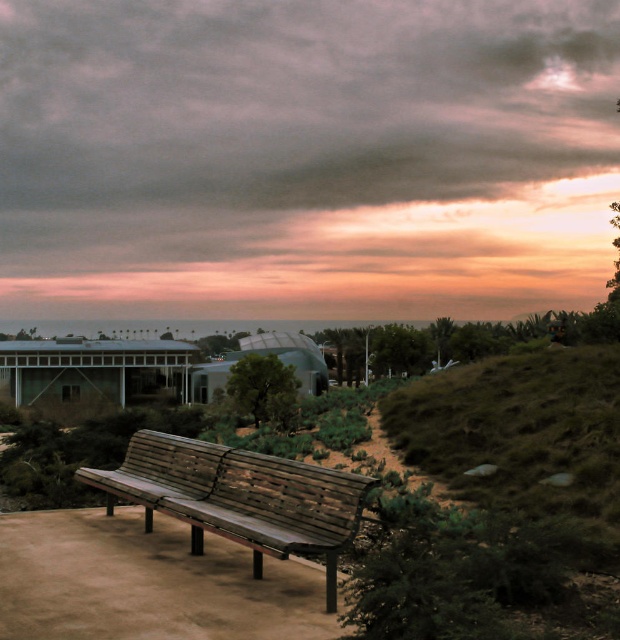
Question: Can you confirm if cloudy sky at upper center is positioned to the right of wooden bench at center?

Choices:
 (A) yes
 (B) no

Answer: (A)

Question: Which object is closer to the camera taking this photo?

Choices:
 (A) cloudy sky at upper center
 (B) wooden bench at center

Answer: (B)

Question: Among these points, which one is farthest from the camera?

Choices:
 (A) (156, 220)
 (B) (290, 531)

Answer: (A)

Question: Can you confirm if cloudy sky at upper center is positioned above wooden bench at center?

Choices:
 (A) no
 (B) yes

Answer: (B)

Question: Does cloudy sky at upper center appear on the left side of wooden bench at center?

Choices:
 (A) no
 (B) yes

Answer: (A)

Question: Which point appears closest to the camera in this image?

Choices:
 (A) (279, 484)
 (B) (231, 68)

Answer: (A)